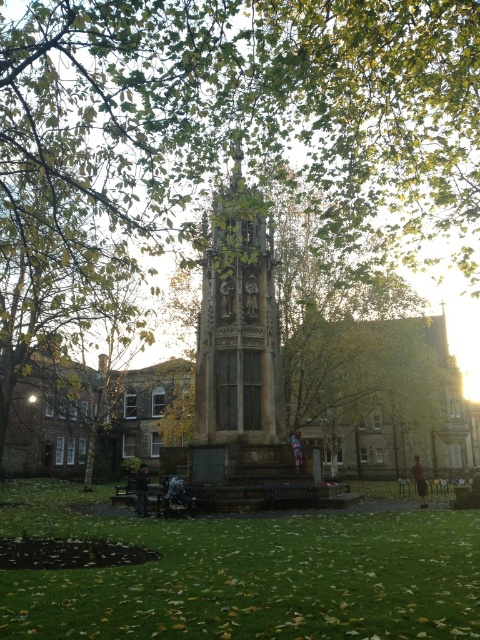
You are standing in the park and see the green grass at lower center and the stone statue at center. Which object is located directly above the other?

The stone statue at center is directly above the green grass at lower center because the green grass at lower center is positioned under it.